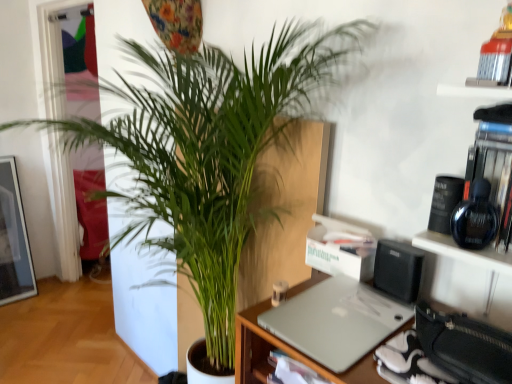
Question: From a real-world perspective, is green leafy plant at center above or below silver metallic laptop at center?

Choices:
 (A) below
 (B) above

Answer: (A)

Question: Considering the positions of point (180, 57) and point (286, 304), is point (180, 57) closer or farther from the camera than point (286, 304)?

Choices:
 (A) farther
 (B) closer

Answer: (A)

Question: Looking at their shapes, would you say green leafy plant at center is wider or thinner than silver metallic laptop at center?

Choices:
 (A) thin
 (B) wide

Answer: (B)

Question: In terms of width, does silver metallic laptop at center look wider or thinner when compared to green leafy plant at center?

Choices:
 (A) thin
 (B) wide

Answer: (A)

Question: Is silver metallic laptop at center bigger or smaller than green leafy plant at center?

Choices:
 (A) big
 (B) small

Answer: (B)

Question: In terms of height, does silver metallic laptop at center look taller or shorter compared to green leafy plant at center?

Choices:
 (A) short
 (B) tall

Answer: (A)

Question: Is silver metallic laptop at center in front of or behind green leafy plant at center in the image?

Choices:
 (A) front
 (B) behind

Answer: (B)